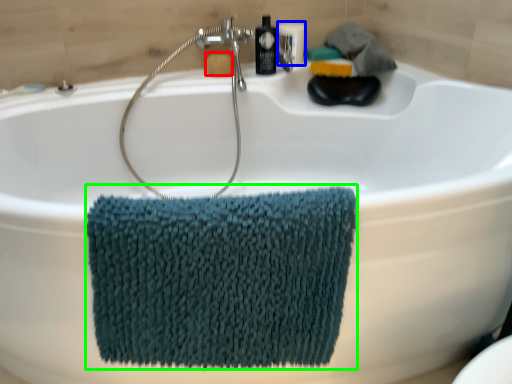
Question: Which is nearer to the soap (highlighted by a red box)? toiletry (highlighted by a blue box) or bath towel (highlighted by a green box).

Choices:
 (A) toiletry
 (B) bath towel

Answer: (A)